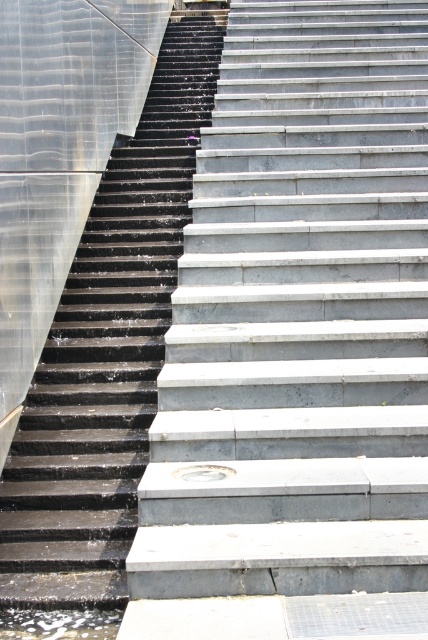
Question: Among these points, which one is nearest to the camera?

Choices:
 (A) (50, 557)
 (B) (211, 422)

Answer: (A)

Question: Does smooth concrete stairs at center have a lesser width compared to black rubber stairs at left?

Choices:
 (A) no
 (B) yes

Answer: (A)

Question: Is smooth concrete stairs at center above black rubber stairs at left?

Choices:
 (A) no
 (B) yes

Answer: (B)

Question: Which point appears farthest from the camera in this image?

Choices:
 (A) (85, 257)
 (B) (404, 291)

Answer: (A)

Question: In this image, where is smooth concrete stairs at center located relative to black rubber stairs at left?

Choices:
 (A) left
 (B) right

Answer: (B)

Question: Which of the following is the farthest from the observer?

Choices:
 (A) black rubber stairs at left
 (B) smooth concrete stairs at center

Answer: (A)